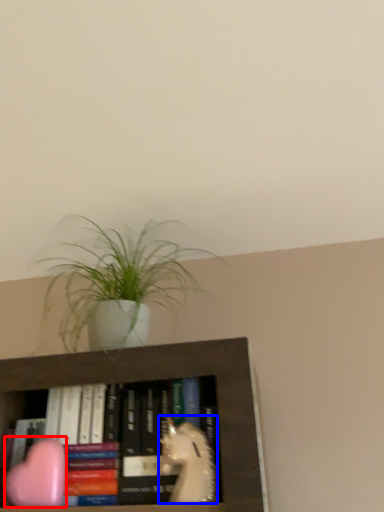
Question: Which object is further to the camera taking this photo, animal (highlighted by a red box) or animal (highlighted by a blue box)?

Choices:
 (A) animal
 (B) animal

Answer: (A)